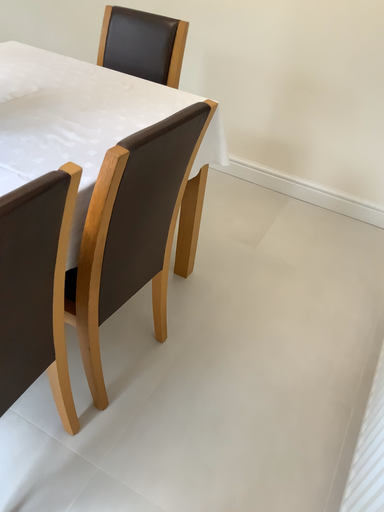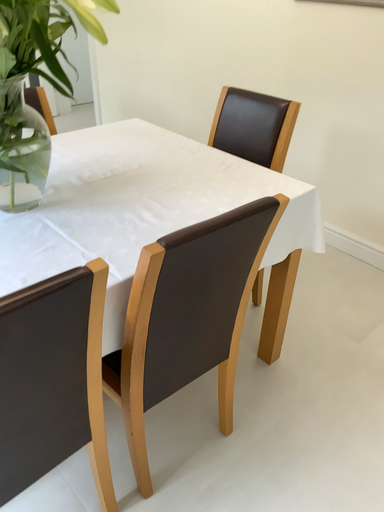
Question: Which way did the camera rotate in the video?

Choices:
 (A) rotated left
 (B) rotated right

Answer: (A)